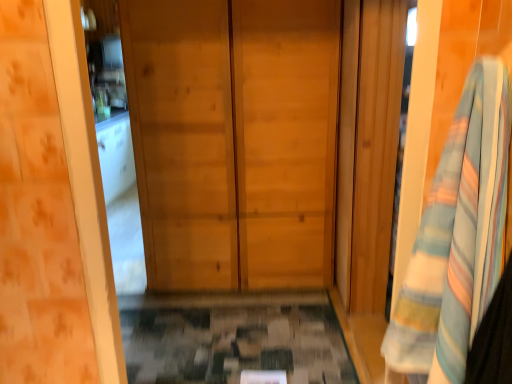
What do you see at coordinates (457, 236) in the screenshot? I see `striped cotton bath towel at right` at bounding box center [457, 236].

The height and width of the screenshot is (384, 512). What are the coordinates of `striped cotton bath towel at right` in the screenshot? It's located at (457, 236).

Locate an element on the screen. Image resolution: width=512 pixels, height=384 pixels. natural wood door at center is located at coordinates coord(234,139).

What do you see at coordinates (234, 139) in the screenshot? The height and width of the screenshot is (384, 512). I see `natural wood door at center` at bounding box center [234, 139].

Identify the location of striped cotton bath towel at right. This screenshot has width=512, height=384. (457, 236).

Based on their positions, is natural wood door at center located to the left or right of striped cotton bath towel at right?

Clearly, natural wood door at center is on the left of striped cotton bath towel at right in the image.

Considering the positions of objects natural wood door at center and striped cotton bath towel at right in the image provided, who is in front, natural wood door at center or striped cotton bath towel at right?

striped cotton bath towel at right is closer to the camera.

Between point (193, 82) and point (393, 340), which one is positioned in front?

The point (393, 340) is in front.

From the image's perspective, does natural wood door at center appear lower than striped cotton bath towel at right?

No.

From a real-world perspective, which is physically below, natural wood door at center or striped cotton bath towel at right?

natural wood door at center.

Which object is thinner, natural wood door at center or striped cotton bath towel at right?

With smaller width is striped cotton bath towel at right.

Can you confirm if natural wood door at center is shorter than striped cotton bath towel at right?

In fact, natural wood door at center may be taller than striped cotton bath towel at right.

Can you confirm if natural wood door at center is smaller than striped cotton bath towel at right?

Incorrect, natural wood door at center is not smaller in size than striped cotton bath towel at right.

Would you say striped cotton bath towel at right is part of natural wood door at center's contents?

No, striped cotton bath towel at right is not a part of natural wood door at center.

Is natural wood door at center not near striped cotton bath towel at right?

Yes, natural wood door at center is far from striped cotton bath towel at right.

Could you tell me if natural wood door at center is facing striped cotton bath towel at right?

Yes, natural wood door at center is oriented towards striped cotton bath towel at right.

This screenshot has height=384, width=512. What are the coordinates of `door behind the striped cotton bath towel at right` in the screenshot? It's located at (234, 139).

Considering the relative positions of striped cotton bath towel at right and natural wood door at center in the image provided, is striped cotton bath towel at right to the left or to the right of natural wood door at center?

Based on their positions, striped cotton bath towel at right is located to the right of natural wood door at center.

Is the depth of striped cotton bath towel at right less than that of natural wood door at center?

Yes, striped cotton bath towel at right is closer to the camera.

Does point (463, 177) lie behind point (169, 117)?

No, it is not.

From the image's perspective, between striped cotton bath towel at right and natural wood door at center, who is located below?

striped cotton bath towel at right appears lower in the image.

From a real-world perspective, does striped cotton bath towel at right sit lower than natural wood door at center?

No.

Which of these two, striped cotton bath towel at right or natural wood door at center, is thinner?

Thinner between the two is striped cotton bath towel at right.

Who is shorter, striped cotton bath towel at right or natural wood door at center?

striped cotton bath towel at right is shorter.

Considering the sizes of objects striped cotton bath towel at right and natural wood door at center in the image provided, who is smaller, striped cotton bath towel at right or natural wood door at center?

striped cotton bath towel at right.

Choose the correct answer: Is striped cotton bath towel at right inside natural wood door at center or outside it?

striped cotton bath towel at right cannot be found inside natural wood door at center.

Is striped cotton bath towel at right not near natural wood door at center?

Yes, striped cotton bath towel at right is far from natural wood door at center.

Is striped cotton bath towel at right facing towards natural wood door at center?

No.

How many degrees apart are the facing directions of striped cotton bath towel at right and natural wood door at center?

The angular difference between striped cotton bath towel at right and natural wood door at center is 83.9 degrees.

Measure the distance between striped cotton bath towel at right and natural wood door at center.

striped cotton bath towel at right and natural wood door at center are 5.60 feet apart from each other.

Where is `bath towel in front of the natural wood door at center`? This screenshot has height=384, width=512. bath towel in front of the natural wood door at center is located at coordinates (457, 236).

Where is `door behind the striped cotton bath towel at right`? The image size is (512, 384). door behind the striped cotton bath towel at right is located at coordinates (234, 139).

This screenshot has width=512, height=384. What are the coordinates of `bath towel below the natural wood door at center (from the image's perspective)` in the screenshot? It's located at (457, 236).